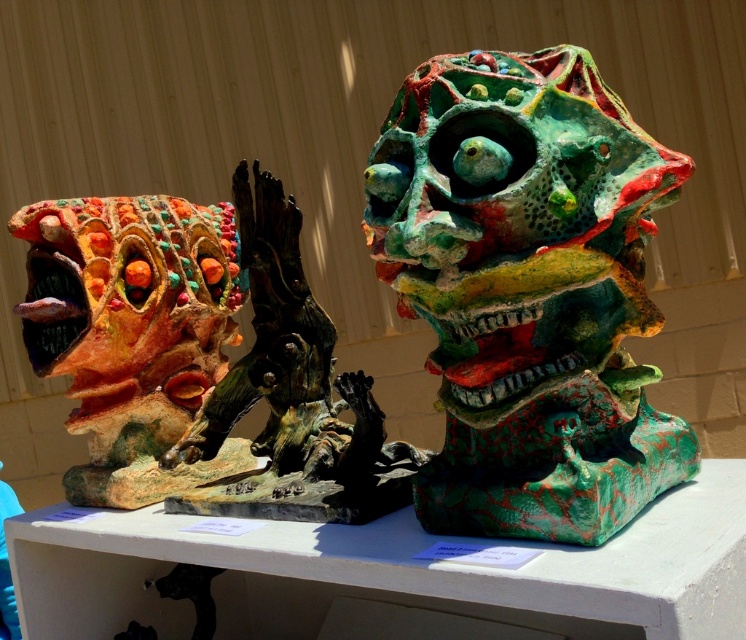
You are an art curator planning to install a motion sensor between the two sculptures. The sensor needs to be placed exactly halfway between the textured green sculpture at center and the other sculpture. Given their coordinates, can you determine the coordinates for the sensor?

The coordinates for the sensor should be the midpoint between the two sculptures. Since the textured green sculpture at center is at point (527,291), the midpoint would require knowing the coordinates of the other sculpture. However, the provided information only specifies the position of the textured green sculpture at center. Without the coordinates of the second sculpture, the exact midpoint cannot be calculated.

You are an art curator examining two sculptures on a white pedestal. You notice the matte ceramic dragon at left and the textured clay sculpture at left. Which of these two sculptures is larger in size?

The textured clay sculpture at left is larger than the matte ceramic dragon at left.

You are an art curator planning to install a new light fixture above the textured green sculpture at center. The light fixture requires a minimum clearance of 0.6 meters above the sculpture to function properly. Given the sculpture is positioned at point 0.455 meters in height, will the light fixture have sufficient clearance?

The textured green sculpture at center is located at point 0.455 meters in height. Since the required clearance is 0.6 meters, the light fixture will not have sufficient clearance as it needs to be at least 0.6 meters above the sculpture.